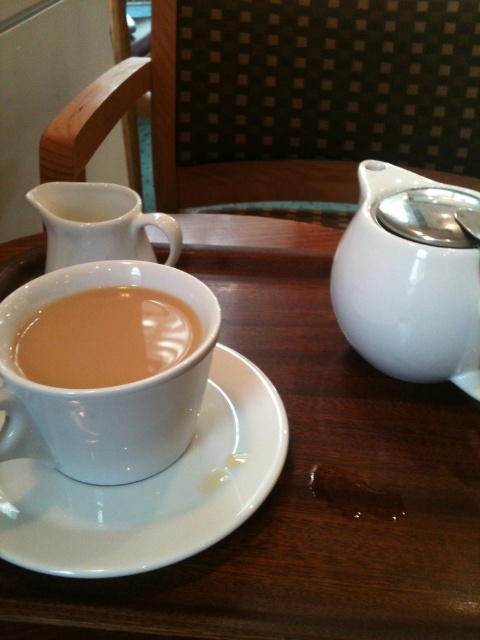
Question: Which point is farther to the camera?

Choices:
 (A) matte ceramic cup at center
 (B) matte ceramic cup at center-left
 (C) white glossy table at center
 (D) white glossy teapot at upper right

Answer: (D)

Question: Which object appears farthest from the camera in this image?

Choices:
 (A) matte ceramic cup at center
 (B) white glossy table at center

Answer: (A)

Question: Is white glossy table at center further to camera compared to white glossy teapot at upper right?

Choices:
 (A) no
 (B) yes

Answer: (A)

Question: Does white glossy teapot at upper right appear on the left side of matte ceramic cup at center?

Choices:
 (A) no
 (B) yes

Answer: (A)

Question: Which point is farther to the camera?

Choices:
 (A) click(x=162, y=301)
 (B) click(x=268, y=342)

Answer: (B)

Question: Does white glossy table at center have a larger size compared to white glossy teapot at upper right?

Choices:
 (A) yes
 (B) no

Answer: (A)